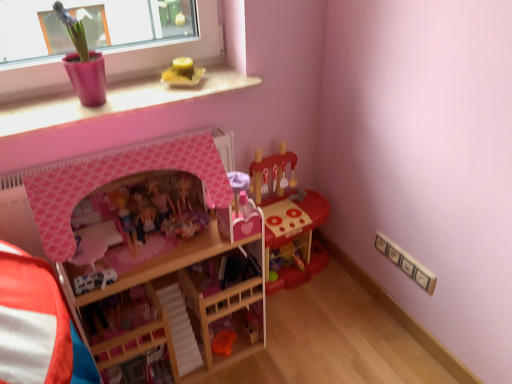
Question: Would you say yellow wax candle at upper center, positioned as the 2th toy in right-to-left order, is to the left or to the right of pink matte dollhouse at center, which is the 3th toy in left-to-right order, in the picture?

Choices:
 (A) left
 (B) right

Answer: (B)

Question: From a real-world perspective, relative to pink matte dollhouse at center, which is the 3th toy in left-to-right order, is yellow wax candle at upper center, the fourth toy from the left, vertically above or below?

Choices:
 (A) below
 (B) above

Answer: (B)

Question: Which of these objects is positioned farthest from the wooden bunk bed at center?

Choices:
 (A) pink matte dollhouse at center, which is the 3th toy from right to left
 (B) yellow wax candle at upper center, positioned as the 2th toy in right-to-left order
 (C) matte plastic play kitchen at center, which is the 1th toy from right to left
 (D) matte pink pot at upper left, the 1th toy in the left-to-right sequence
 (E) white plastic car at center, the fourth toy positioned from the right

Answer: (B)

Question: Which of these objects is positioned closest to the wooden bunk bed at center?

Choices:
 (A) pink matte dollhouse at center, which is the 3th toy in left-to-right order
 (B) yellow wax candle at upper center, the fourth toy from the left
 (C) matte plastic play kitchen at center, which is the 1th toy from right to left
 (D) pink plastic window sill at upper left
 (E) white plastic car at center, the 2th toy in the left-to-right sequence

Answer: (A)